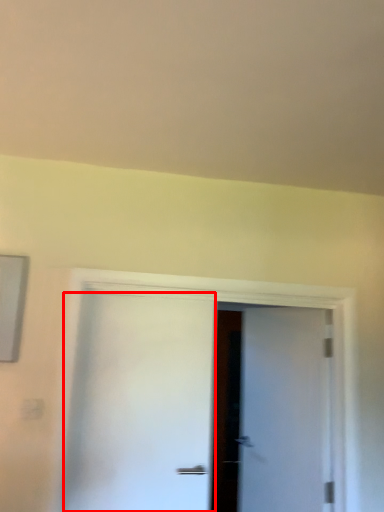
Question: Observing the image, what is the correct spatial positioning of door (annotated by the red box) in reference to door?

Choices:
 (A) left
 (B) right

Answer: (A)